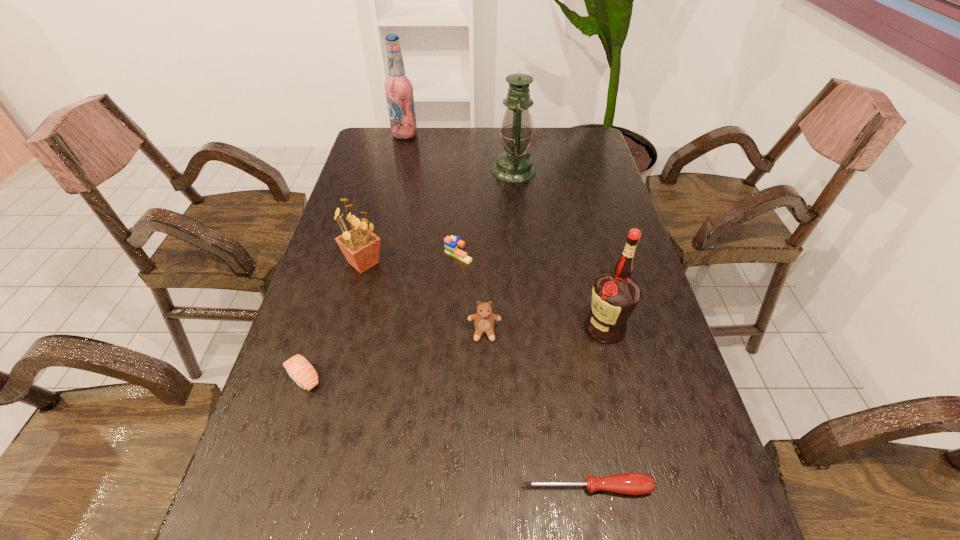
Identify the location of vacant space positioned on the right of the taller alcohol. (483, 135).

At what (x,y) coordinates should I click in order to perform the action: click on free point located 0.210m on the left of the oil lamp. Please return your answer as a coordinate pair (x, y). The height and width of the screenshot is (540, 960). Looking at the image, I should click on (431, 170).

The width and height of the screenshot is (960, 540). Find the location of `vacant space located on the label of the nearer alcohol`. vacant space located on the label of the nearer alcohol is located at coordinates (505, 328).

Locate an element on the screen. This screenshot has width=960, height=540. vacant region located 0.320m on the label of the nearer alcohol is located at coordinates (450, 328).

Find the location of a particular element. The image size is (960, 540). vacant position located 0.230m on the label of the nearer alcohol is located at coordinates tap(488, 328).

Where is `vacant space located 0.060m at the front of the sunflower with flowers visible`? The height and width of the screenshot is (540, 960). vacant space located 0.060m at the front of the sunflower with flowers visible is located at coordinates (355, 295).

This screenshot has height=540, width=960. I want to click on vacant space located 0.270m on the front-facing side of the teddy bear, so click(486, 460).

The image size is (960, 540). In order to click on free space located 0.110m on the left of the third shortest object in this screenshot , I will do `click(406, 253)`.

This screenshot has height=540, width=960. In order to click on free space located 0.390m on the back of the seventh farthest object in this screenshot , I will do `click(345, 245)`.

In order to click on vacant space located 0.110m on the left of the screwdriver in this screenshot , I will do `click(462, 488)`.